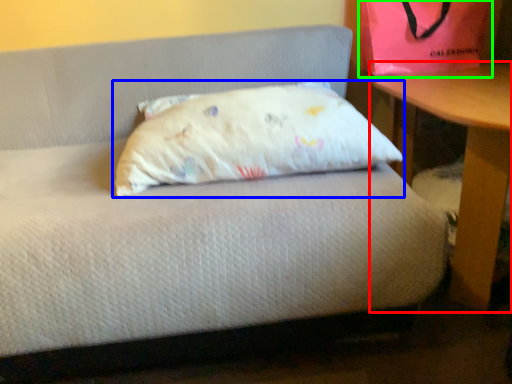
Question: Considering the real-world distances, which object is closest to table (highlighted by a red box)? pillow (highlighted by a blue box) or bean bag chair (highlighted by a green box).

Choices:
 (A) pillow
 (B) bean bag chair

Answer: (B)